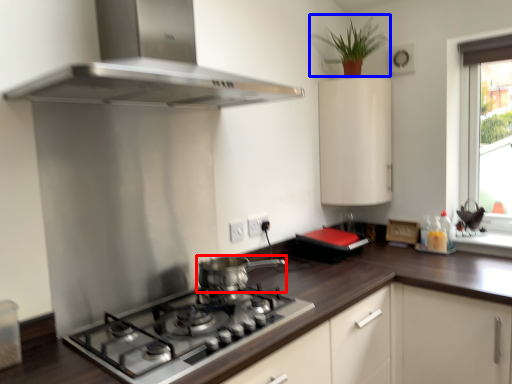
Question: Which object is closer to the camera taking this photo, kitchen appliance (highlighted by a red box) or plant (highlighted by a blue box)?

Choices:
 (A) kitchen appliance
 (B) plant

Answer: (A)